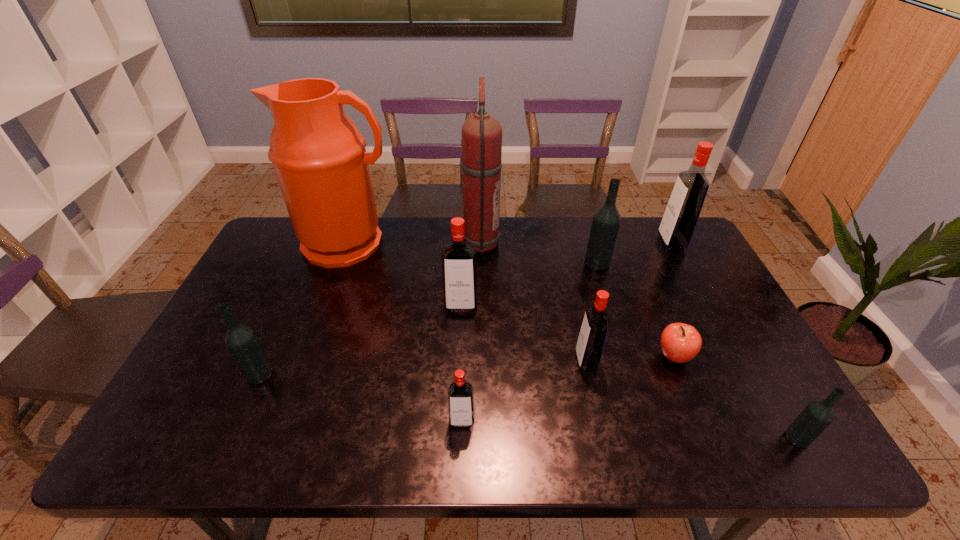
Locate an element on the screen. The height and width of the screenshot is (540, 960). vacant space located on the front of the eighth object from left to right is located at coordinates (714, 456).

Locate an element on the screen. The height and width of the screenshot is (540, 960). water jug located in the far edge section of the desktop is located at coordinates (319, 157).

Locate an element on the screen. fire extinguisher positioned at the far edge is located at coordinates (481, 134).

Where is `water jug that is at the left edge`? water jug that is at the left edge is located at coordinates (319, 157).

Where is `vodka located in the left edge section of the desktop`? The height and width of the screenshot is (540, 960). vodka located in the left edge section of the desktop is located at coordinates (241, 340).

Locate an element on the screen. The image size is (960, 540). object situated at the far left corner is located at coordinates (319, 157).

Locate an element on the screen. object at the far right corner is located at coordinates (682, 212).

Find the location of a particular element. The image size is (960, 540). object positioned at the near right corner is located at coordinates (818, 415).

Image resolution: width=960 pixels, height=540 pixels. I want to click on vacant space at the far edge, so click(x=441, y=242).

Locate an element on the screen. Image resolution: width=960 pixels, height=540 pixels. free space at the near edge of the desktop is located at coordinates (686, 450).